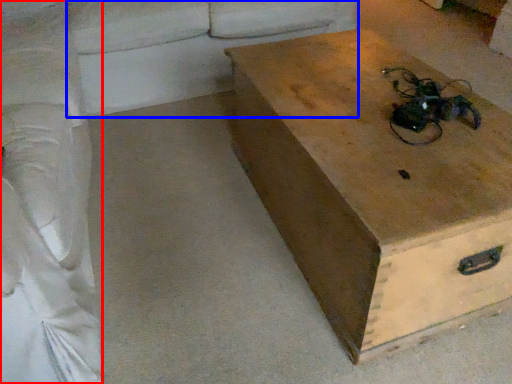
Question: Which object is further to the camera taking this photo, couch (highlighted by a red box) or couch (highlighted by a blue box)?

Choices:
 (A) couch
 (B) couch

Answer: (B)